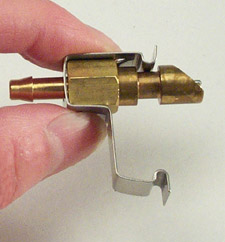
The width and height of the screenshot is (225, 242). I want to click on silver bracket, so click(x=139, y=188).